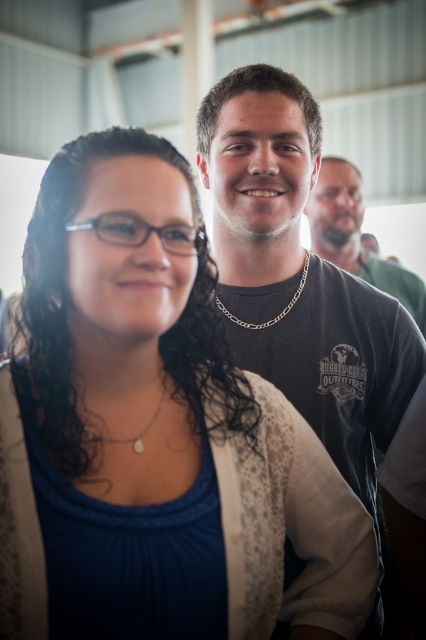
Question: Is the position of dark gray t-shirt at center less distant than that of pearl necklace at center?

Choices:
 (A) no
 (B) yes

Answer: (A)

Question: Estimate the real-world distances between objects in this image. Which object is closer to the gold chain at center?

Choices:
 (A) matte white cardigan at center
 (B) dark gray t-shirt at center

Answer: (B)

Question: Which object is the closest to the matte white cardigan at center?

Choices:
 (A) matte black shirt at right
 (B) pearl necklace at center
 (C) dark gray t-shirt at center

Answer: (B)

Question: Is pearl necklace at center thinner than gold chain at center?

Choices:
 (A) no
 (B) yes

Answer: (B)

Question: Does dark gray t-shirt at center appear over pearl necklace at center?

Choices:
 (A) yes
 (B) no

Answer: (A)

Question: Which of the following is the closest to the observer?

Choices:
 (A) (307, 264)
 (B) (359, 259)
 (C) (149, 426)

Answer: (C)